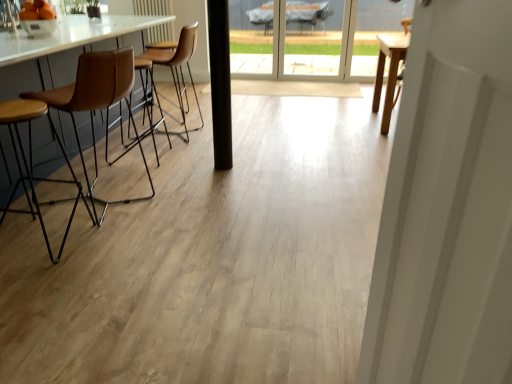
You are a GUI agent. You are given a task and a screenshot of the screen. Output one action in this format:
    pyautogui.click(x=<x>, y=<y>)
    Task: Click on the vacant area situated below brown leather stool at left, positioned as the second chair in front-to-back order (from a real-world perspective)
    This screenshot has height=384, width=512.
    Given the screenshot: What is the action you would take?
    [111, 195]